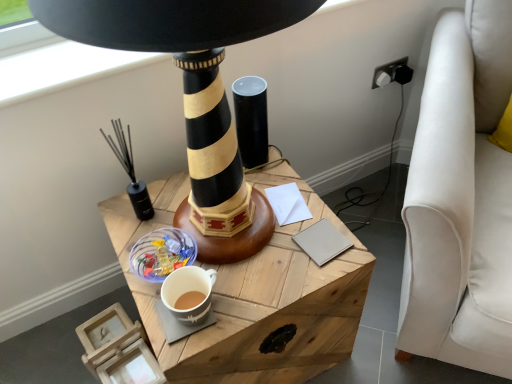
Question: Considering the positions of white paper at center, which ranks as the 2th notepad in front-to-back order, and beige leather notepad at center, the second notepad positioned from the back, in the image, is white paper at center, which ranks as the 2th notepad in front-to-back order, bigger or smaller than beige leather notepad at center, the second notepad positioned from the back,?

Choices:
 (A) big
 (B) small

Answer: (B)

Question: Is white paper at center, which ranks as the 2th notepad in front-to-back order, taller or shorter than beige leather notepad at center, the second notepad positioned from the back?

Choices:
 (A) short
 (B) tall

Answer: (A)

Question: Considering the real-world distances, which object is farthest from the black plastic plug at upper right?

Choices:
 (A) matte black cylinder at center, which ranks as the first candle holder in right-to-left order
 (B) matte ceramic mug at lower center
 (C) white paper at center, which is the 1th notepad from back to front
 (D) black matte candle holder at left, which is the 1th candle holder in left-to-right order
 (E) beige leather notepad at center, the second notepad positioned from the back

Answer: (B)

Question: Which is nearer to the wooden table at center?

Choices:
 (A) black plastic plug at upper right
 (B) black matte lighthouse at center
 (C) matte black cylinder at center, which ranks as the first candle holder in right-to-left order
 (D) beige leather notepad at center, placed as the 1th notepad when sorted from front to back
 (E) matte ceramic mug at lower center

Answer: (B)